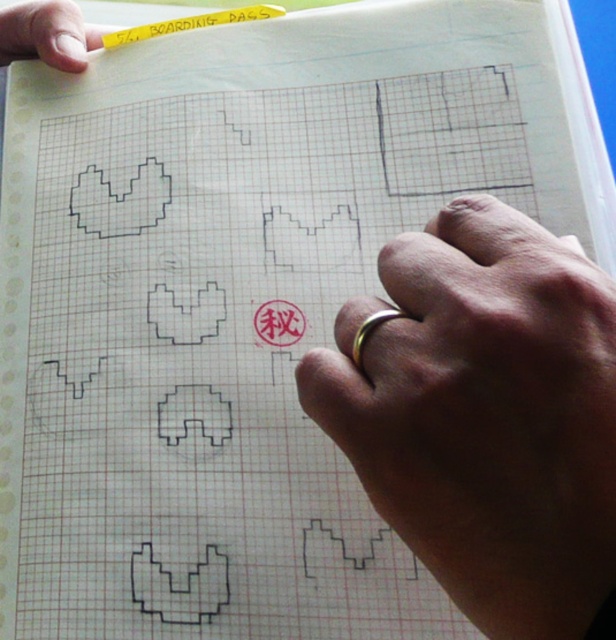
You are an artist who needs to place a sticker exactly at the coordinates given in the image. The sticker is 1 cm in diameter. Where should you place the sticker so that it doesn not overlap with the gold ring at center?

The gold ring at center is located at coordinates point (x=485, y=416). To avoid overlapping, place the sticker at a different coordinate away from this point.

You are looking at a drawing of geometric shapes on graph paper. There is a point labeled as point (41, 40). If you want to touch this point with a pencil tip that is 0.5 inches long, can you reach it without moving your hand?

The point (41, 40) is 20.44 inches from the viewer. Since the pencil tip is only 0.5 inches long, you cannot reach the point without moving your hand because the distance is much greater than the pencil length.

You are an artist working on a graph paper. You have two points marked on your paper at coordinates point (x=22, y=44) and point (x=278, y=12). If you want to draw a line connecting these two points, which point should you start drawing from to ensure the line is visible over the other shape?

You should start drawing from point (x=278, y=12) because it is in front of point (x=22, y=44), so the line will be visible over the other shape.